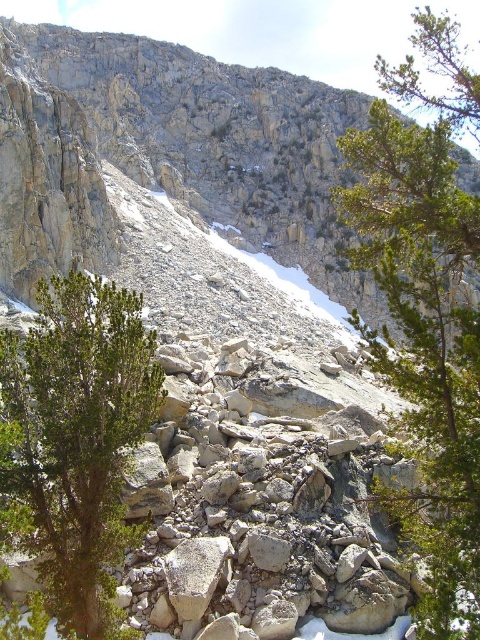
Question: Does green leafy tree at center lie in front of green leafy shrub at left?

Choices:
 (A) yes
 (B) no

Answer: (B)

Question: Estimate the real-world distances between objects in this image. Which object is closer to the green leafy shrub at left?

Choices:
 (A) rough gray rock at center
 (B) green leafy tree at center

Answer: (B)

Question: Which point appears farthest from the camera in this image?

Choices:
 (A) (407, 522)
 (B) (296, 204)
 (C) (54, 464)

Answer: (B)

Question: Is rough gray rock at center wider than green leafy tree at center?

Choices:
 (A) no
 (B) yes

Answer: (B)

Question: Based on their relative distances, which object is farther from the green leafy shrub at left?

Choices:
 (A) green leafy tree at center
 (B) rough gray rock at center

Answer: (B)

Question: Is rough gray rock at center above green leafy shrub at left?

Choices:
 (A) yes
 (B) no

Answer: (A)